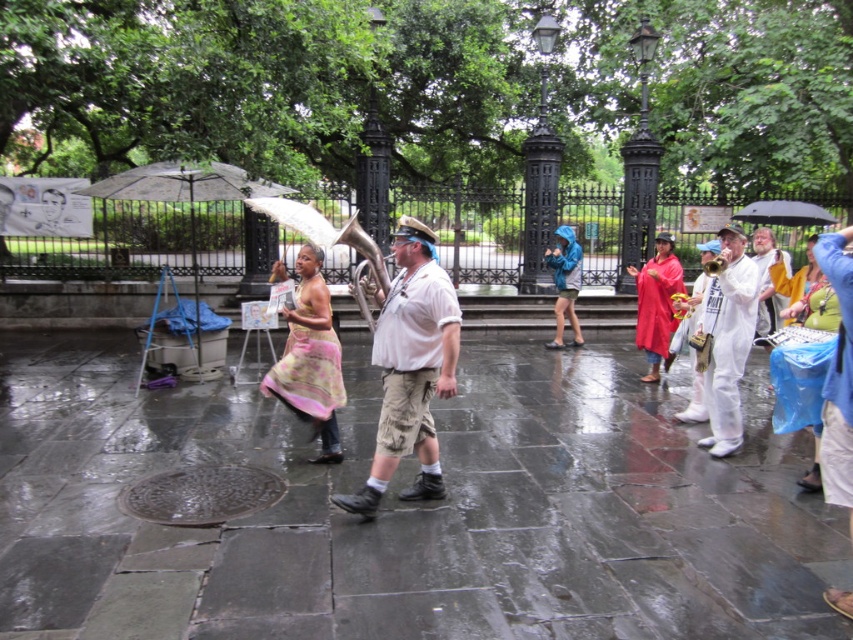
Question: Is blue fabric umbrella at upper right positioned at the back of black fabric umbrella at upper right?

Choices:
 (A) yes
 (B) no

Answer: (B)

Question: Which object appears closest to the camera in this image?

Choices:
 (A) white matte trumpet at right
 (B) blue fabric umbrella at upper right

Answer: (B)

Question: Estimate the real-world distances between objects in this image. Which object is closer to the blue plastic bag at right?

Choices:
 (A) black fabric umbrella at upper right
 (B) blue fabric umbrella at upper right

Answer: (B)

Question: Is floral chiffon dress at center to the right of rubber poncho at center from the viewer's perspective?

Choices:
 (A) no
 (B) yes

Answer: (A)

Question: Does dark gray stone pavement at center have a greater width compared to white cotton shirt at center?

Choices:
 (A) yes
 (B) no

Answer: (B)

Question: Among these objects, which one is nearest to the camera?

Choices:
 (A) white matte trumpet at right
 (B) white cotton shirt at center

Answer: (B)